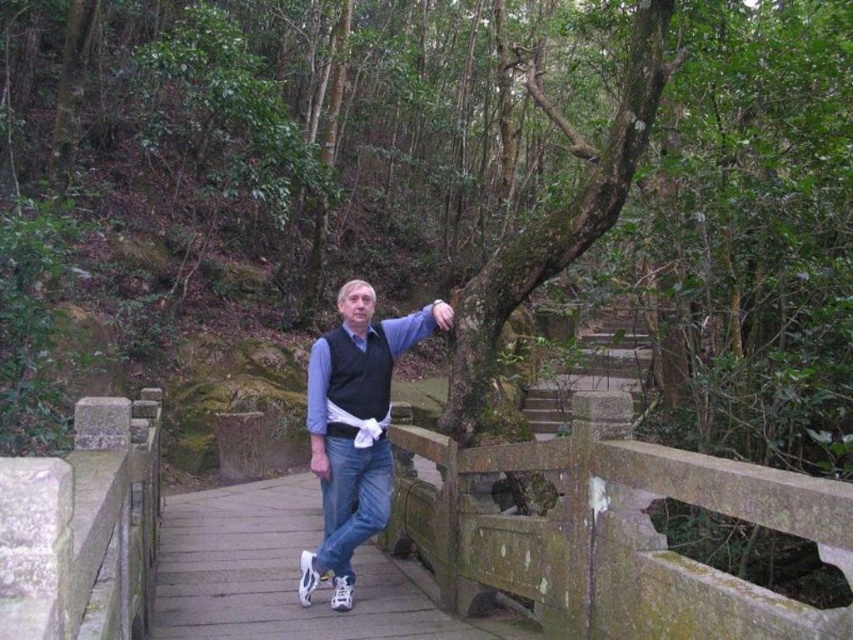
Question: Which object is closer to the camera taking this photo?

Choices:
 (A) white leather sneakers at center
 (B) blue denim jeans at center

Answer: (B)

Question: Which point is farther to the camera?

Choices:
 (A) blue denim jeans at center
 (B) green mossy stone rail at lower center
 (C) white leather sneakers at center

Answer: (C)

Question: Can you confirm if white leather sneakers at center is thinner than blue denim jeans at center?

Choices:
 (A) yes
 (B) no

Answer: (B)

Question: Is green mossy stone rail at lower center positioned behind white leather sneakers at center?

Choices:
 (A) no
 (B) yes

Answer: (A)

Question: Considering the real-world distances, which object is farthest from the blue denim jeans at center?

Choices:
 (A) white leather sneakers at center
 (B) green mossy stone rail at lower center

Answer: (A)

Question: Does green mossy stone rail at lower center have a greater width compared to blue denim jeans at center?

Choices:
 (A) yes
 (B) no

Answer: (A)